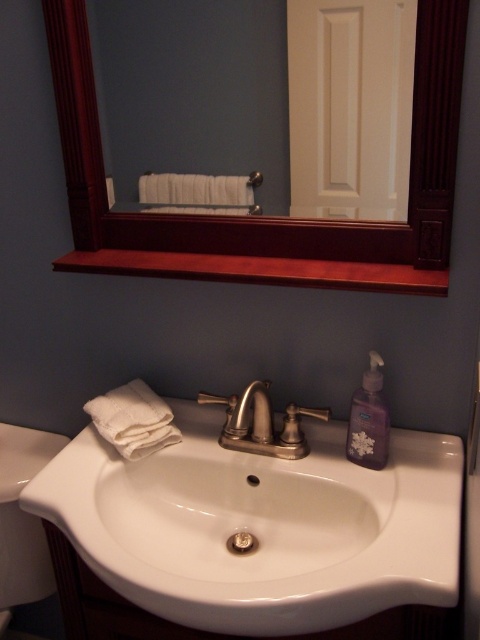
Question: Based on their relative distances, which object is farther from the white cotton hand towel at lower left?

Choices:
 (A) polished chrome faucet at center
 (B) silver metallic towel bar at upper center
 (C) translucent plastic soap at sink center
 (D) white glossy sink at center

Answer: (B)

Question: Which of the following is the farthest from the observer?

Choices:
 (A) white glossy sink at center
 (B) silver metallic towel bar at upper center
 (C) translucent plastic soap at sink center
 (D) polished chrome faucet at center

Answer: (C)

Question: Is purple translucent soap dispenser at right thinner than translucent plastic soap at sink center?

Choices:
 (A) yes
 (B) no

Answer: (B)

Question: Does mahogany wood mirror at upper center lie in front of silver metallic towel bar at upper center?

Choices:
 (A) no
 (B) yes

Answer: (B)

Question: Which point is closer to the camera?

Choices:
 (A) (141, 456)
 (B) (249, 544)
 (C) (376, 387)

Answer: (C)

Question: Is white cotton hand towel at lower left behind purple translucent soap dispenser at right?

Choices:
 (A) yes
 (B) no

Answer: (A)